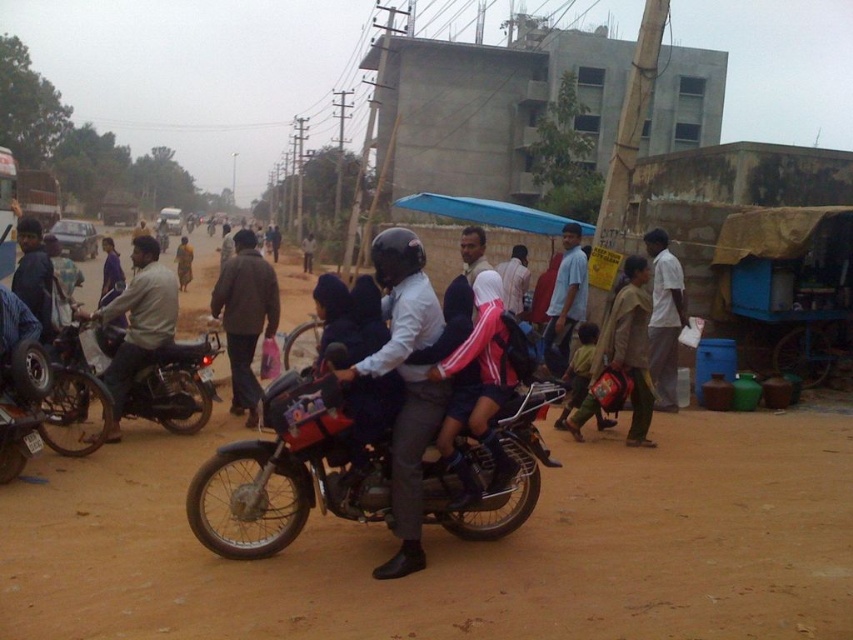
Between red matte motorcycle at center and brushed metal motorcycle at center, which one has more height?

With more height is red matte motorcycle at center.

Can you confirm if red matte motorcycle at center is smaller than brushed metal motorcycle at center?

Incorrect, red matte motorcycle at center is not smaller in size than brushed metal motorcycle at center.

Who is more forward, (288, 528) or (16, 355)?

Point (288, 528) is in front.

Image resolution: width=853 pixels, height=640 pixels. Find the location of `red matte motorcycle at center`. red matte motorcycle at center is located at coordinates (294, 468).

Between red matte motorcycle at center and light beige shirt at center, which one appears on the right side from the viewer's perspective?

From the viewer's perspective, red matte motorcycle at center appears more on the right side.

Is point (291, 524) in front of point (146, 326)?

Yes, point (291, 524) is in front of point (146, 326).

Locate an element on the screen. Image resolution: width=853 pixels, height=640 pixels. red matte motorcycle at center is located at coordinates (294, 468).

Is point (416, 474) positioned after point (160, 365)?

No, (416, 474) is in front of (160, 365).

The height and width of the screenshot is (640, 853). In order to click on matte black helmet at center in this screenshot , I will do `click(405, 384)`.